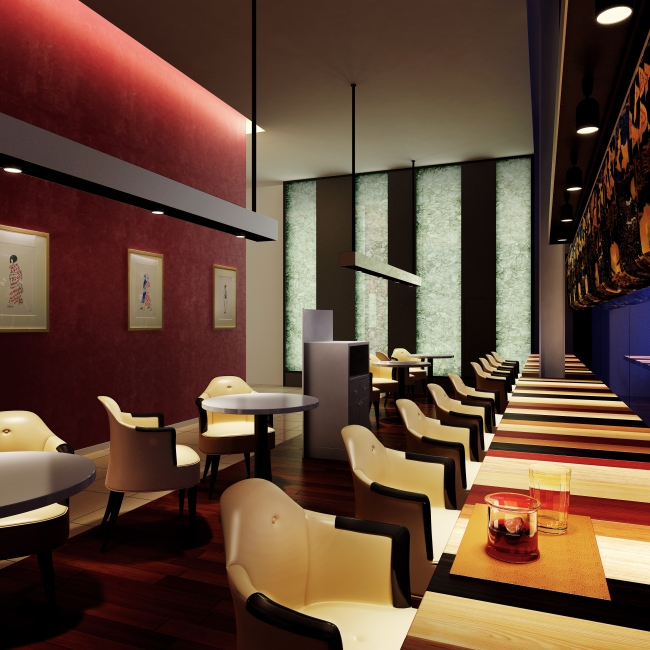
In order to click on drinking glass in this screenshot , I will do `click(556, 504)`, `click(530, 526)`.